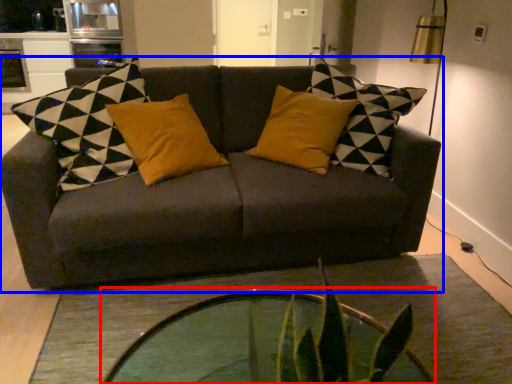
Question: Which object appears farthest to the camera in this image, coffee table (highlighted by a red box) or studio couch (highlighted by a blue box)?

Choices:
 (A) coffee table
 (B) studio couch

Answer: (B)